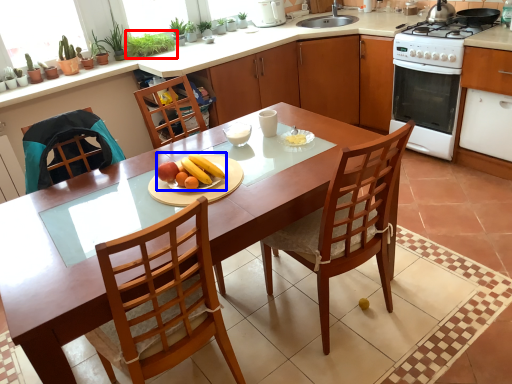
Question: Which point is closer to the camera, plant (highlighted by a red box) or fruit dish (highlighted by a blue box)?

Choices:
 (A) plant
 (B) fruit dish

Answer: (B)